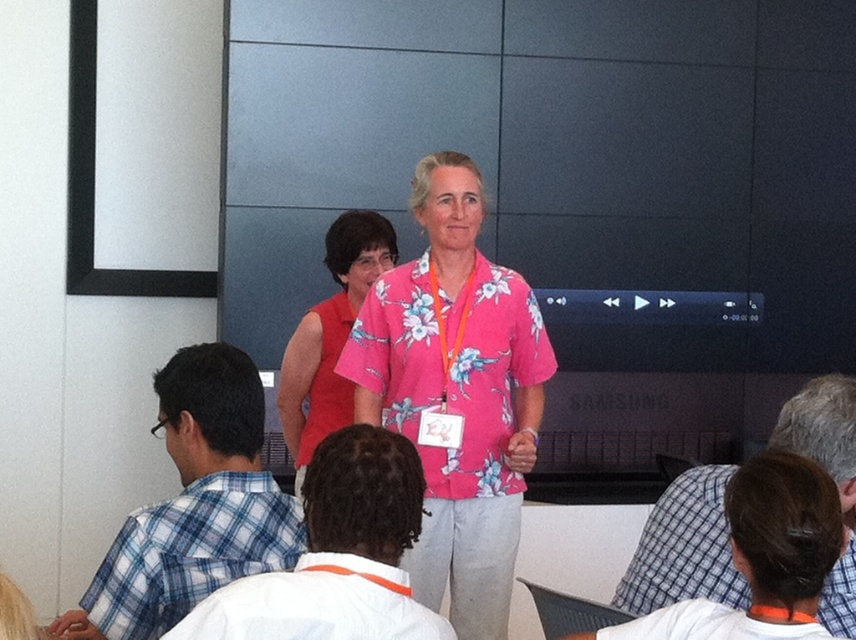
Can you confirm if blue plaid shirt at left is positioned to the left of white checkered shirt at lower right?

Indeed, blue plaid shirt at left is positioned on the left side of white checkered shirt at lower right.

Which is behind, point (278, 515) or point (785, 404)?

Positioned behind is point (785, 404).

Find the location of `blue plaid shirt at left`. blue plaid shirt at left is located at coordinates (194, 506).

Between blue plaid shirt at left and white cotton shirt at center, which one has less height?

white cotton shirt at center is shorter.

Which is more to the left, blue plaid shirt at left or white cotton shirt at center?

Positioned to the left is blue plaid shirt at left.

Where is `blue plaid shirt at left`? The image size is (856, 640). blue plaid shirt at left is located at coordinates (194, 506).

Find the location of a particular element. The image size is (856, 640). blue plaid shirt at left is located at coordinates (194, 506).

Between floral print shirt at center and blue plaid shirt at left, which one appears on the left side from the viewer's perspective?

blue plaid shirt at left is more to the left.

Which is in front, point (467, 422) or point (156, 388)?

Point (156, 388)

What are the coordinates of `floral print shirt at center` in the screenshot? It's located at (456, 394).